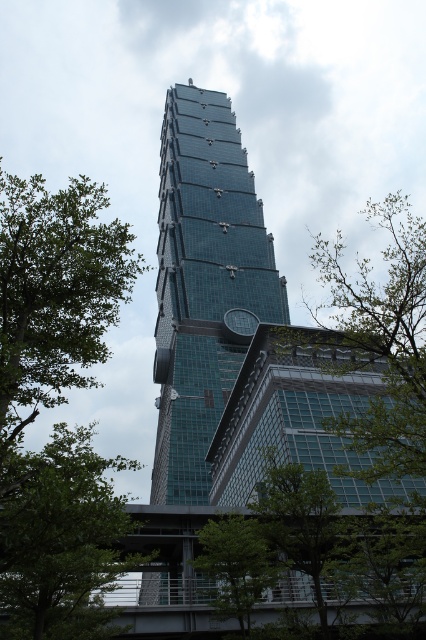
Is point (327, 275) closer to viewer compared to point (229, 596)?

No, it is behind (229, 596).

Between green leafy tree at lower right and green leafy tree at lower center, which one appears on the left side from the viewer's perspective?

From the viewer's perspective, green leafy tree at lower center appears more on the left side.

Locate an element on the screen. green leafy tree at lower right is located at coordinates (379, 342).

Is green leafy tree at left further to camera compared to green leafy tree at lower center?

No, it is in front of green leafy tree at lower center.

Is green leafy tree at left below green leafy tree at lower center?

Actually, green leafy tree at left is above green leafy tree at lower center.

Describe the element at coordinates (55, 291) in the screenshot. The width and height of the screenshot is (426, 640). I see `green leafy tree at left` at that location.

Locate an element on the screen. The height and width of the screenshot is (640, 426). green leafy tree at left is located at coordinates (55, 291).

Is transparent glass tower at center further to the viewer compared to green leafy tree at lower right?

Yes, transparent glass tower at center is behind green leafy tree at lower right.

Which of these two, transparent glass tower at center or green leafy tree at lower right, stands taller?

transparent glass tower at center

At what (x,y) coordinates should I click in order to perform the action: click on transparent glass tower at center. Please return your answer as a coordinate pair (x, y). Image resolution: width=426 pixels, height=640 pixels. Looking at the image, I should click on (204, 284).

Find the location of a particular element. transparent glass tower at center is located at coordinates (204, 284).